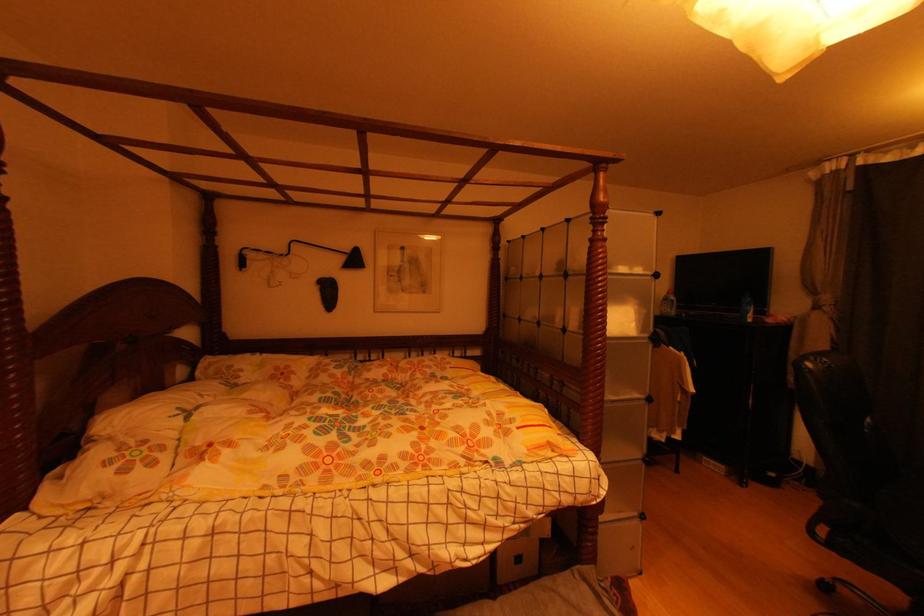
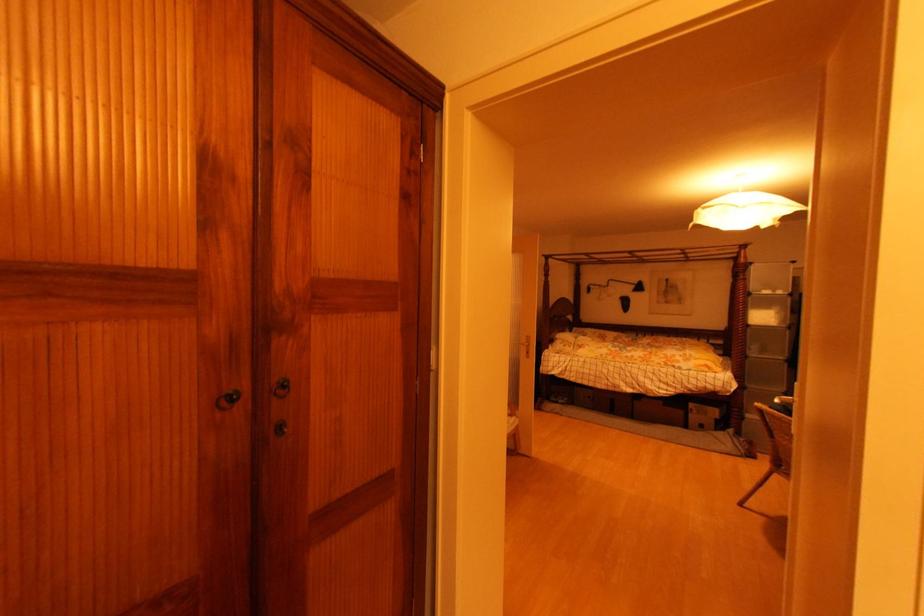
Find the pixel in the second image that matches [614,397] in the first image.

(759, 355)